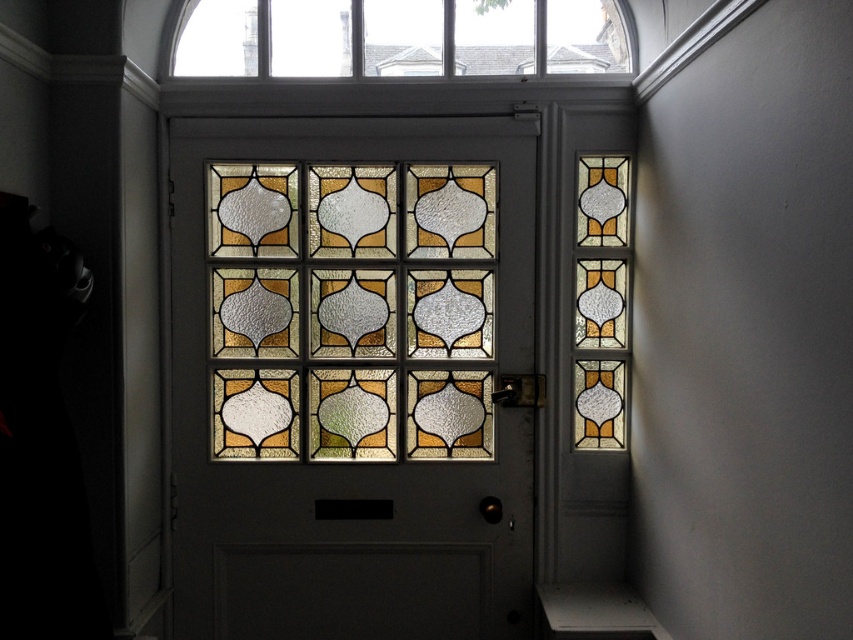
You are standing in front of the door and want to know which stained glass is on the left side. Can you identify which one between the stained glass window at center and the translucent stained glass at center is located to the left?

The stained glass window at center is positioned on the left side of the translucent stained glass at center, so the stained glass window at center is the one on the left.

You are standing in front of the door and need to determine which glass component is taller. Which one is taller between the translucent stained glass at center and the clear glass window at upper center?

The translucent stained glass at center has a greater height compared to the clear glass window at upper center, so the translucent stained glass at center is taller.

You are trying to find the stained glass window at center in the image. According to the scene, where is it located in relation to the clear glass window at upper center?

The stained glass window at center is positioned under the clear glass window at upper center.